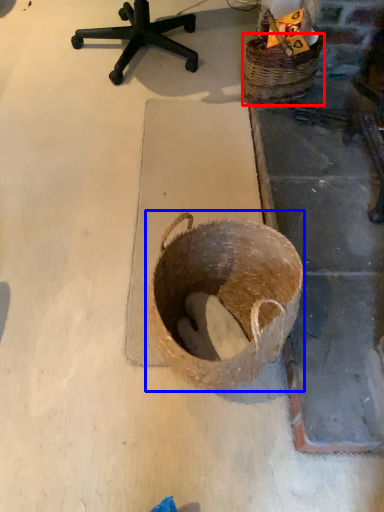
Question: Which object is further to the camera taking this photo, basket (highlighted by a red box) or basket (highlighted by a blue box)?

Choices:
 (A) basket
 (B) basket

Answer: (A)